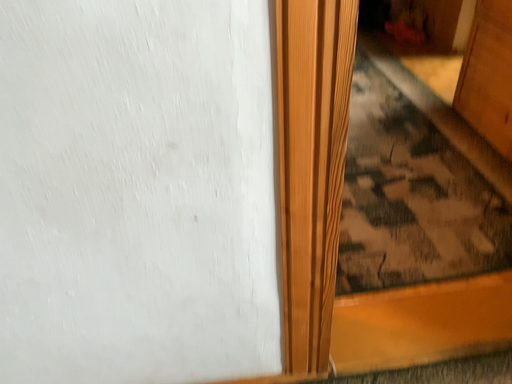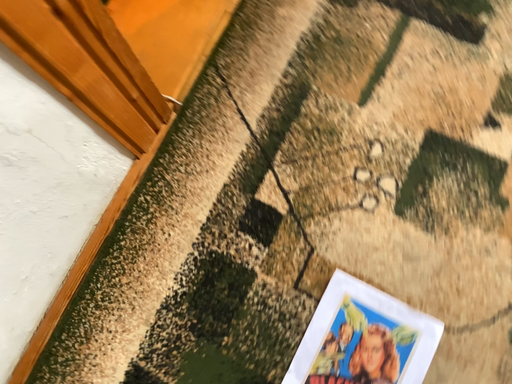
Question: Which way did the camera rotate in the video?

Choices:
 (A) rotated left
 (B) rotated right

Answer: (B)